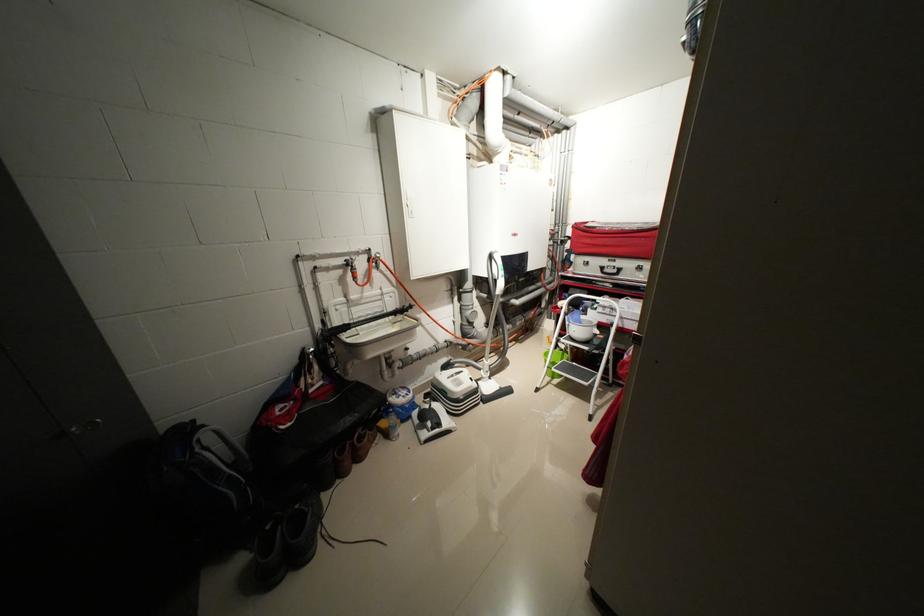
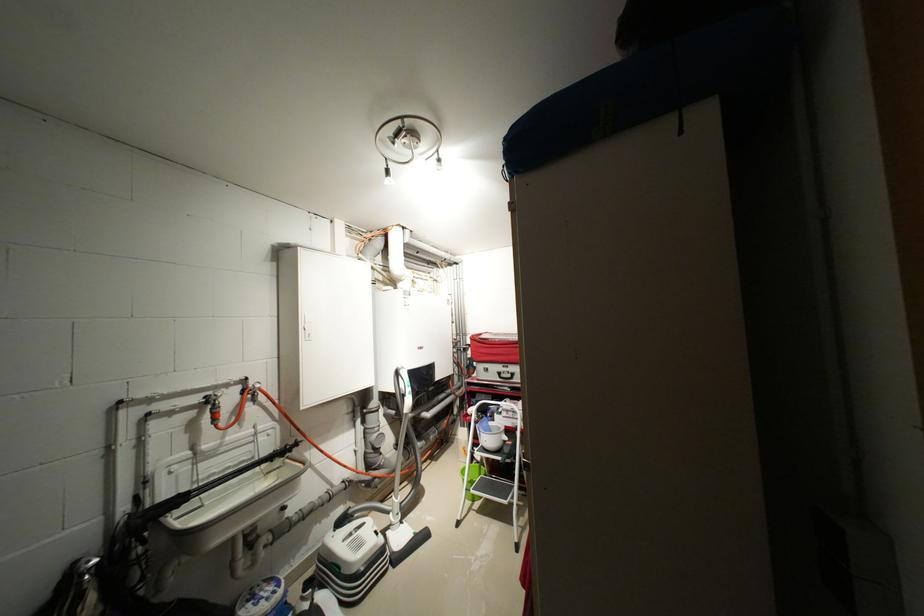
In the second image, find the point that corresponds to point (612, 308) in the first image.

(515, 411)